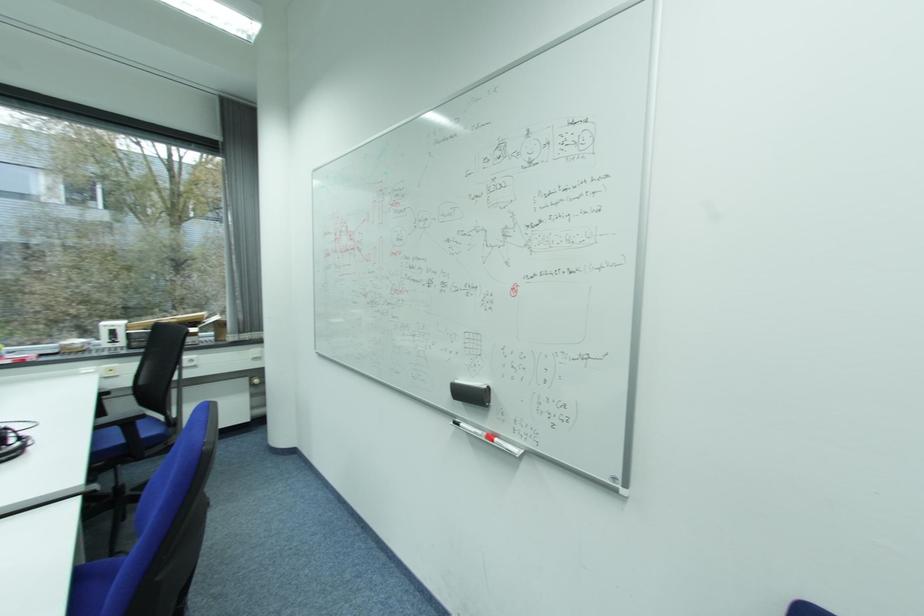
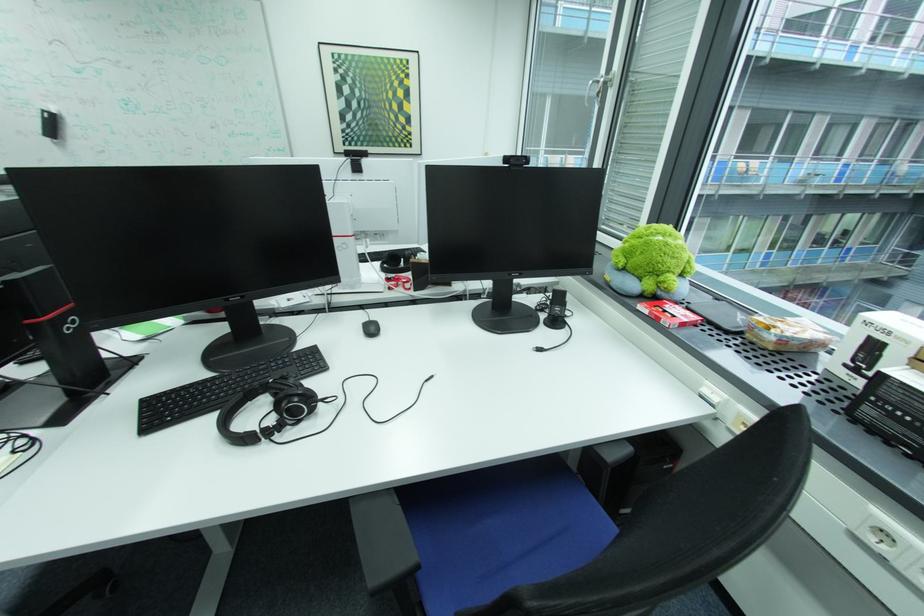
In the second image, find the point that corresponds to point 115,326 in the first image.

(876, 323)